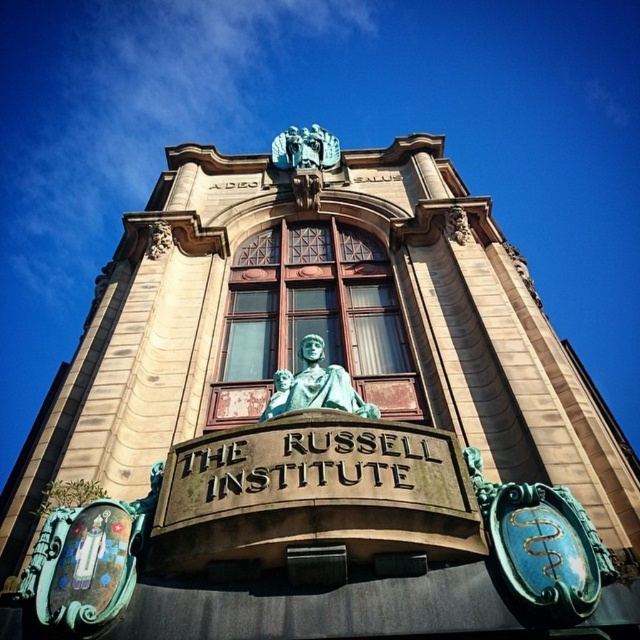
You are a visitor standing in front of The Russell Institute. You see the green patina statue at center and the bronze statue at upper center. Which statue is positioned higher up on the building?

The bronze statue at upper center is positioned higher up on the building than the green patina statue at center.

You are a visitor standing at the entrance of The Russell Institute and want to take a photo that includes both the green patina statue at center and the bronze statue at upper center. Given that your camera has a maximum zoom range of 50 meters, will you be able to capture both statues in the same frame?

The distance between the green patina statue at center and the bronze statue at upper center is 45.44 meters. Since your camera can zoom up to 50 meters, you can capture both statues in the same frame as the distance is within the camera range.

You are standing in front of The Russell Institute and want to locate the green patina statue at center. Which direction should you look to find it?

The green patina statue at center is located at the center of the building, so you should look straight ahead to find it.